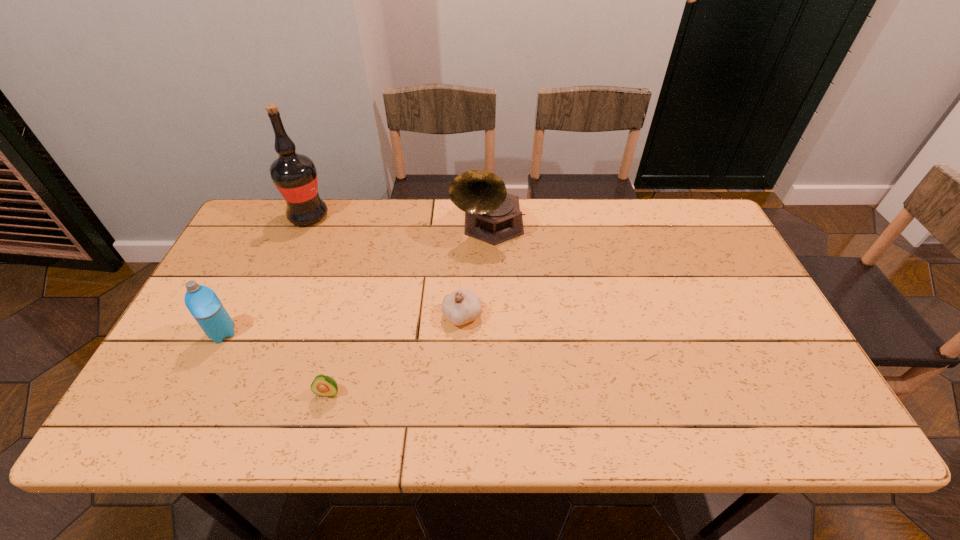
I want to click on free region located 0.080m on the cut side of the shortest object, so click(317, 435).

I want to click on wine bottle that is at the far edge, so click(295, 176).

Where is `phonograph record present at the far edge`? Image resolution: width=960 pixels, height=540 pixels. phonograph record present at the far edge is located at coordinates (492, 215).

Where is `object that is at the near edge`? object that is at the near edge is located at coordinates (323, 385).

Identify the location of wine bottle present at the left edge. (295, 176).

Locate an element on the screen. thermos bottle situated at the left edge is located at coordinates (202, 302).

The image size is (960, 540). I want to click on object situated at the far left corner, so click(x=295, y=176).

At what (x,y) coordinates should I click in order to perform the action: click on free space at the far edge of the desktop. Please return your answer as a coordinate pair (x, y). Looking at the image, I should click on (365, 201).

Identify the location of blank area at the near edge. (301, 417).

In the image, there is a desktop. Identify the location of vacant space at the left edge. (226, 306).